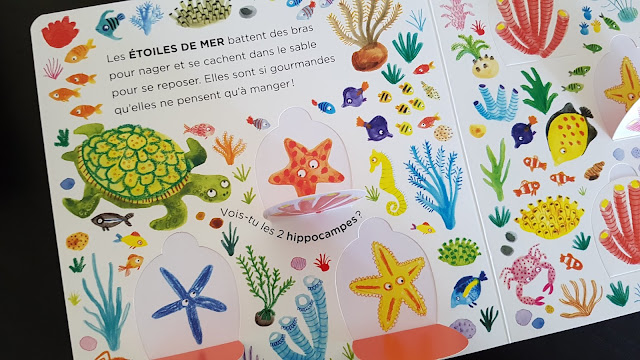
You are a GUI agent. You are given a task and a screenshot of the screen. Output one action in this format:
    pyautogui.click(x=<x>, y=<y>)
    Task: Click on the book
    The image size is (640, 360).
    Given the screenshot: What is the action you would take?
    pos(470,88)